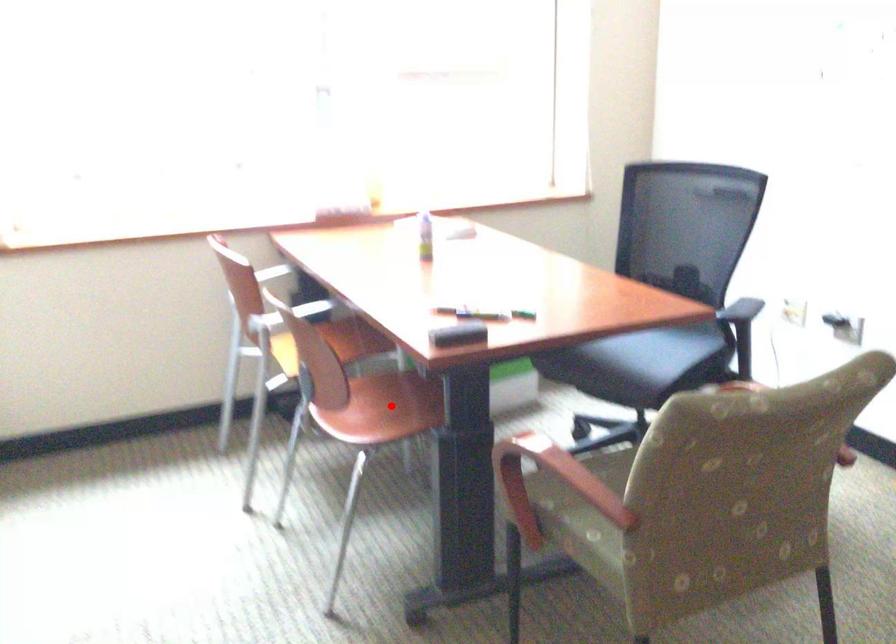
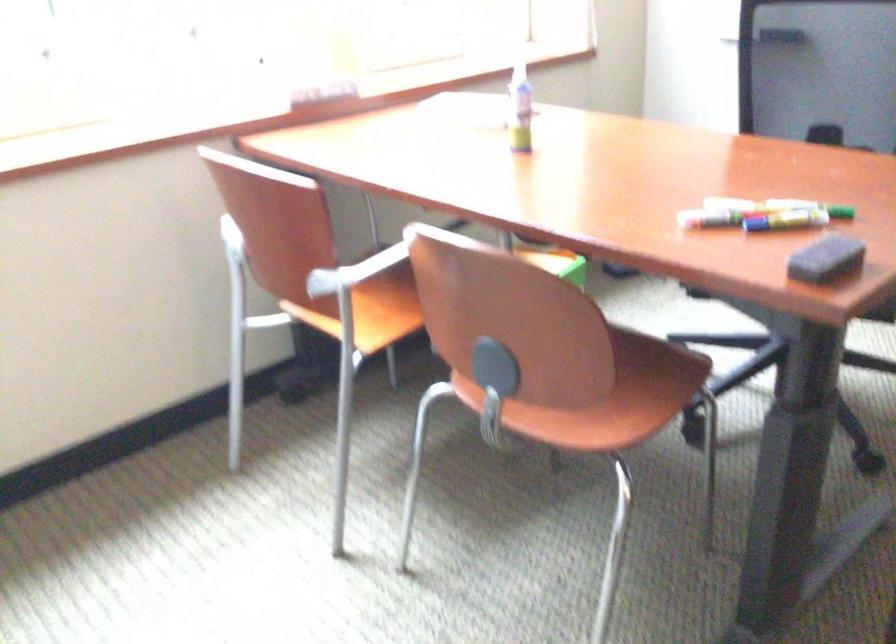
Question: I am providing you with two images of the same scene from different viewpoints. A red point is marked on the first image. Is the red point's position out of view in image 2?

Choices:
 (A) Yes
 (B) No

Answer: (A)